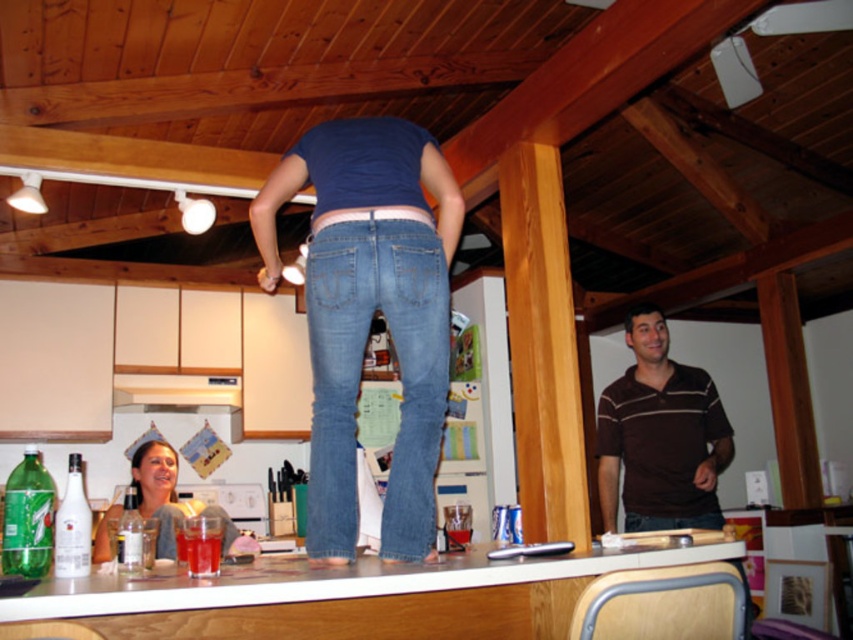
Is brown striped shirt at right to the right of smooth plastic bottle at lower left from the viewer's perspective?

Yes, brown striped shirt at right is to the right of smooth plastic bottle at lower left.

Is brown striped shirt at right taller than smooth plastic bottle at lower left?

Yes.

Does point (612, 397) lie in front of point (103, 525)?

No.

You are a GUI agent. You are given a task and a screenshot of the screen. Output one action in this format:
    pyautogui.click(x=<x>, y=<y>)
    Task: Click on the brown striped shirt at right
    The height and width of the screenshot is (640, 853).
    Given the screenshot: What is the action you would take?
    pyautogui.click(x=660, y=436)

Is point (654, 484) behind point (154, 403)?

No, (654, 484) is closer to viewer.

Image resolution: width=853 pixels, height=640 pixels. Describe the element at coordinates (660, 436) in the screenshot. I see `brown striped shirt at right` at that location.

Who is more distant from viewer, (627,320) or (215,387)?

Point (215,387)

Identify the location of brown striped shirt at right. The image size is (853, 640). (660, 436).

Between white laminate counter at center and denim at center, which one is positioned higher?

denim at center

Consider the image. Is white laminate counter at center to the left of denim at center from the viewer's perspective?

No, white laminate counter at center is not to the left of denim at center.

Between point (480, 605) and point (335, 328), which one is positioned in front?

Point (335, 328) is in front.

Locate an element on the screen. This screenshot has height=640, width=853. white laminate counter at center is located at coordinates (354, 596).